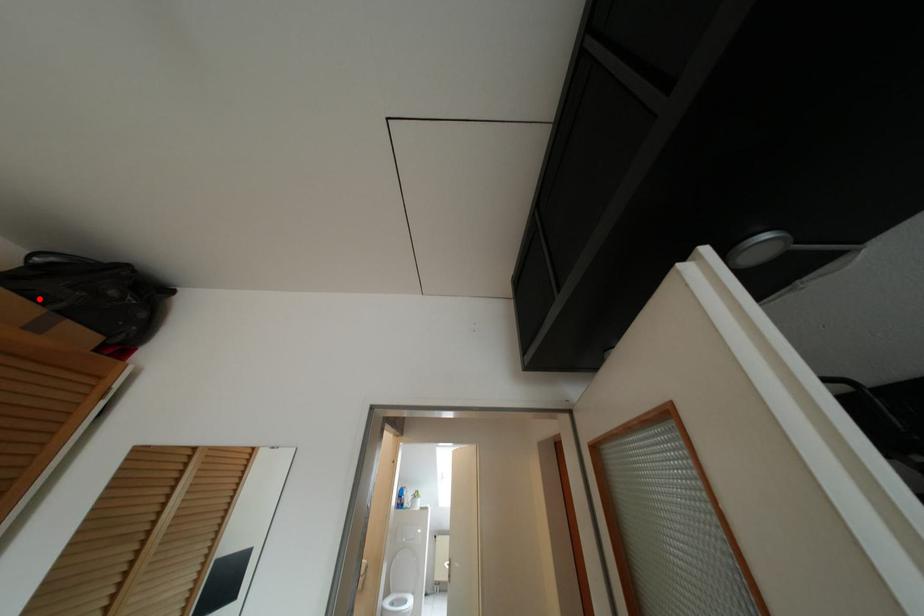
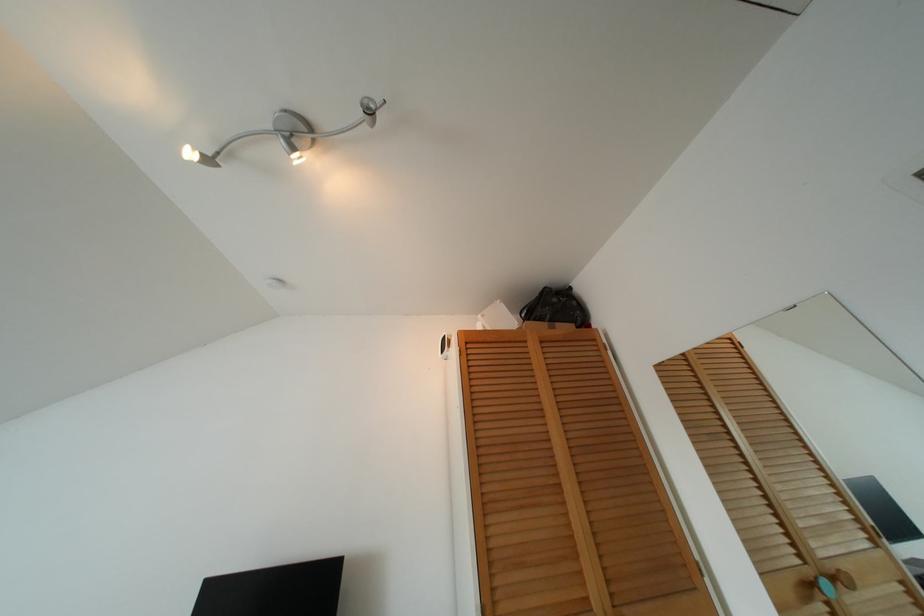
Question: I am providing you with two images of the same scene from different viewpoints. Given a red point in image1, look at the same physical point in image2. Is it:

Choices:
 (A) Closer to the viewpoint
 (B) Farther from the viewpoint

Answer: (B)